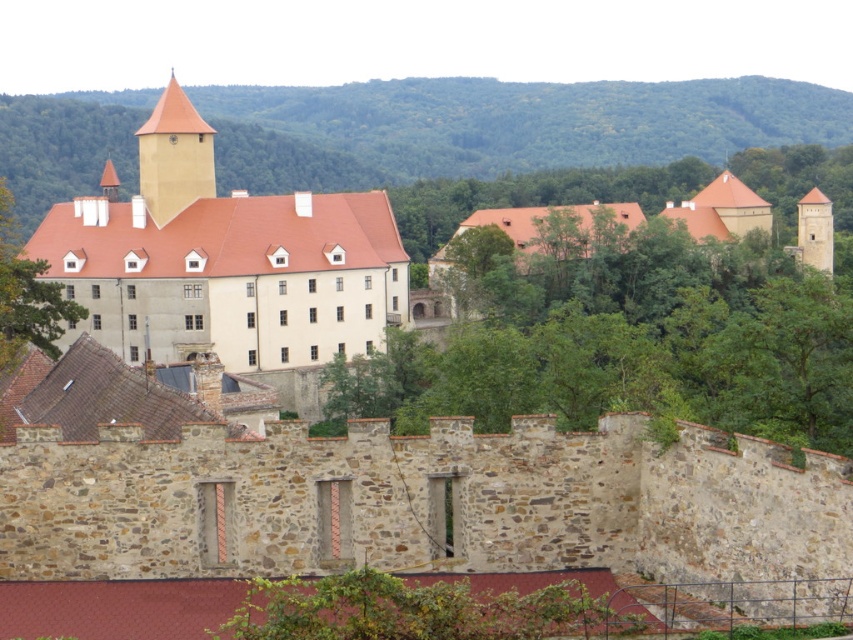
Who is more forward, (302, 164) or (146, 284)?

Positioned in front is point (146, 284).

Can you confirm if green leafy hillside at upper center is positioned to the right of matte beige stone building at center?

Yes, green leafy hillside at upper center is to the right of matte beige stone building at center.

Between point (495, 145) and point (171, 353), which one is positioned in front?

Point (171, 353)

This screenshot has height=640, width=853. What are the coordinates of `green leafy hillside at upper center` in the screenshot? It's located at [500, 128].

How much distance is there between matte yellow tower at upper left and smooth beige tower at right?

268.41 feet

Who is taller, matte yellow tower at upper left or smooth beige tower at right?

matte yellow tower at upper left is taller.

Locate an element on the screen. This screenshot has width=853, height=640. matte yellow tower at upper left is located at coordinates (173, 156).

Where is `matte yellow tower at upper left`? matte yellow tower at upper left is located at coordinates (173, 156).

Is green leafy hillside at upper center bigger than smooth beige tower at right?

Yes, green leafy hillside at upper center is bigger than smooth beige tower at right.

Who is taller, green leafy hillside at upper center or smooth beige tower at right?

green leafy hillside at upper center

Measure the distance between point (433, 177) and camera.

Point (433, 177) and camera are 392.10 meters apart from each other.

Where is `green leafy hillside at upper center`? The image size is (853, 640). green leafy hillside at upper center is located at coordinates (500, 128).